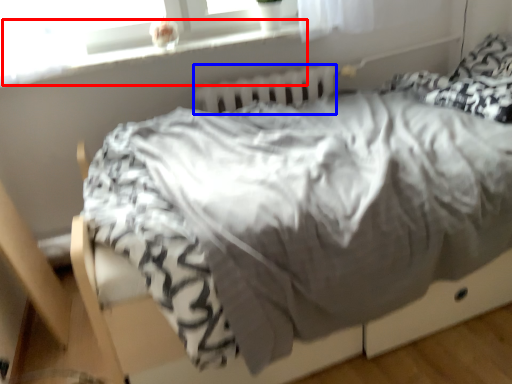
Question: Which object appears closest to the camera in this image, window sill (highlighted by a red box) or radiator (highlighted by a blue box)?

Choices:
 (A) window sill
 (B) radiator

Answer: (A)